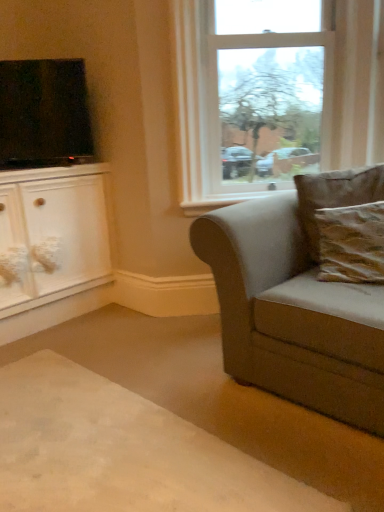
Question: Is clear glass window at upper center oriented towards matte black tv at upper left?

Choices:
 (A) yes
 (B) no

Answer: (B)

Question: Considering the relative positions of clear glass window at upper center and matte black tv at upper left in the image provided, is clear glass window at upper center in front of matte black tv at upper left?

Choices:
 (A) no
 (B) yes

Answer: (B)

Question: Considering the relative sizes of clear glass window at upper center and matte black tv at upper left in the image provided, is clear glass window at upper center taller than matte black tv at upper left?

Choices:
 (A) no
 (B) yes

Answer: (B)

Question: Can you confirm if clear glass window at upper center is positioned to the left of matte black tv at upper left?

Choices:
 (A) no
 (B) yes

Answer: (A)

Question: Does clear glass window at upper center have a lesser width compared to matte black tv at upper left?

Choices:
 (A) yes
 (B) no

Answer: (B)

Question: From a real-world perspective, does clear glass window at upper center sit lower than matte black tv at upper left?

Choices:
 (A) yes
 (B) no

Answer: (B)

Question: From the image's perspective, is suede-like gray couch at right beneath brown textured pillow at right, which appears as the first pillow when viewed from the back?

Choices:
 (A) yes
 (B) no

Answer: (A)

Question: Does suede-like gray couch at right appear on the right side of brown textured pillow at right, which appears as the first pillow when viewed from the back?

Choices:
 (A) no
 (B) yes

Answer: (A)

Question: Is brown textured pillow at right, which appears as the second pillow when viewed from the front, at the back of suede-like gray couch at right?

Choices:
 (A) yes
 (B) no

Answer: (A)

Question: Can you confirm if suede-like gray couch at right is smaller than brown textured pillow at right, which appears as the second pillow when viewed from the front?

Choices:
 (A) no
 (B) yes

Answer: (A)

Question: Considering the relative sizes of suede-like gray couch at right and brown textured pillow at right, which appears as the first pillow when viewed from the back, in the image provided, is suede-like gray couch at right taller than brown textured pillow at right, which appears as the first pillow when viewed from the back,?

Choices:
 (A) yes
 (B) no

Answer: (A)

Question: From a real-world perspective, is suede-like gray couch at right physically below brown textured pillow at right, which appears as the first pillow when viewed from the back?

Choices:
 (A) no
 (B) yes

Answer: (B)

Question: Are clear glass window at upper center and brown textured pillow at right, which is the first pillow in front-to-back order, beside each other?

Choices:
 (A) no
 (B) yes

Answer: (A)